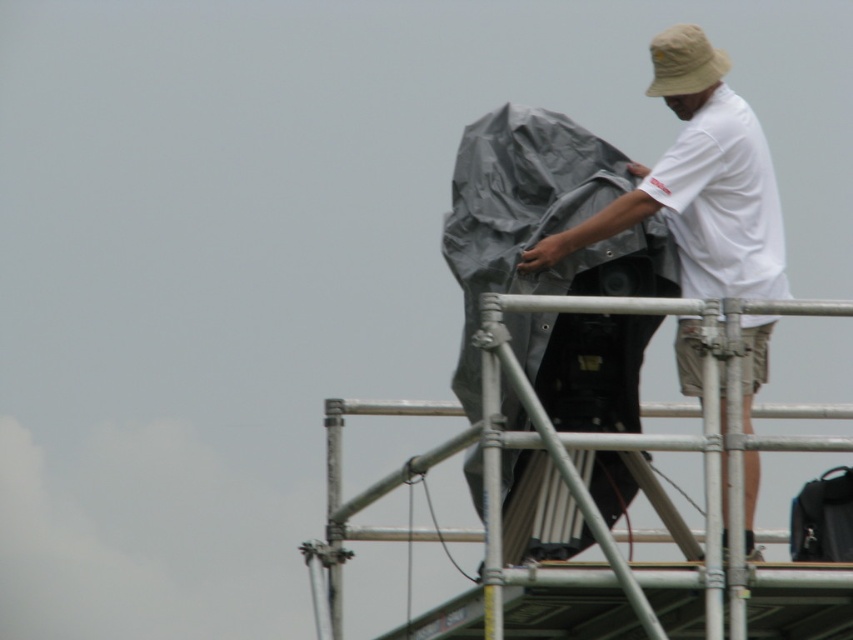
Question: Which object is farther from the camera taking this photo?

Choices:
 (A) black fabric bag at upper right
 (B) white cotton shirt at upper right
 (C) silver metallic scaffolding at upper center

Answer: (A)

Question: Which object appears farthest from the camera in this image?

Choices:
 (A) black fabric bag at upper right
 (B) silver metallic scaffolding at upper center
 (C) white cotton shirt at upper right

Answer: (A)

Question: Estimate the real-world distances between objects in this image. Which object is farther from the silver metallic scaffolding at upper center?

Choices:
 (A) white cotton shirt at upper right
 (B) black fabric bag at upper right

Answer: (B)

Question: Is silver metallic scaffolding at upper center further to camera compared to white cotton shirt at upper right?

Choices:
 (A) yes
 (B) no

Answer: (B)

Question: Does white cotton shirt at upper right have a larger size compared to black fabric bag at upper right?

Choices:
 (A) no
 (B) yes

Answer: (B)

Question: Can you confirm if silver metallic scaffolding at upper center is thinner than black fabric bag at upper right?

Choices:
 (A) yes
 (B) no

Answer: (B)